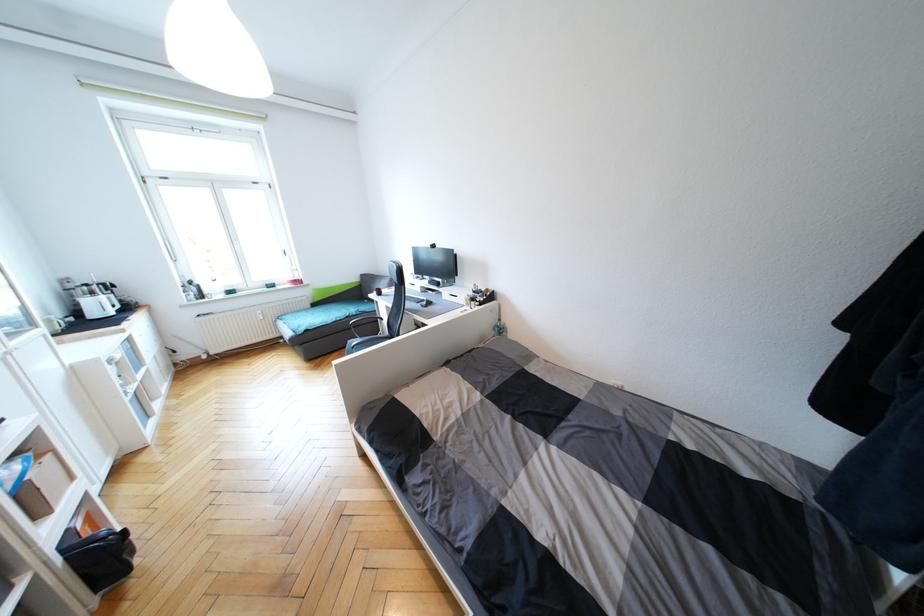
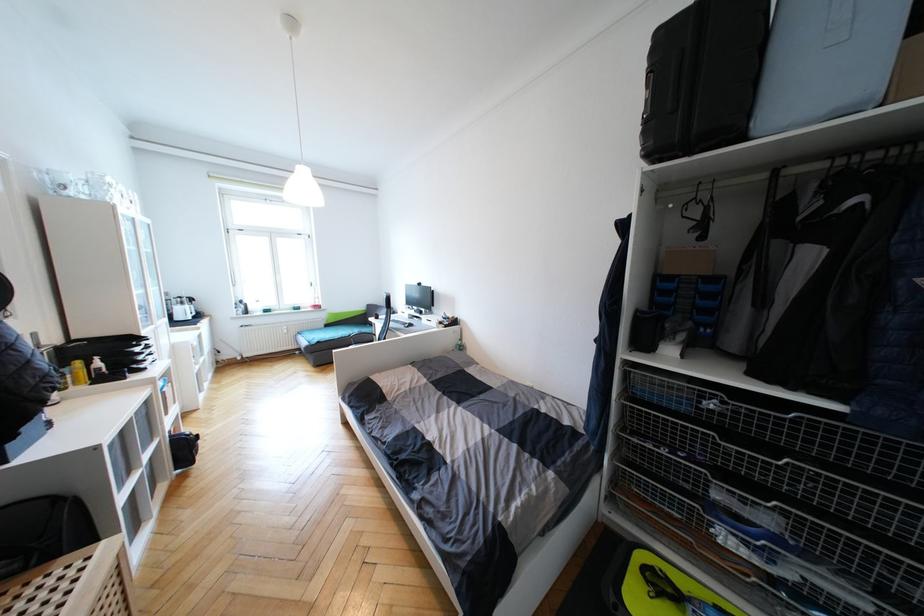
Locate, in the second image, the point that corresponds to [319,306] in the first image.

(331, 326)